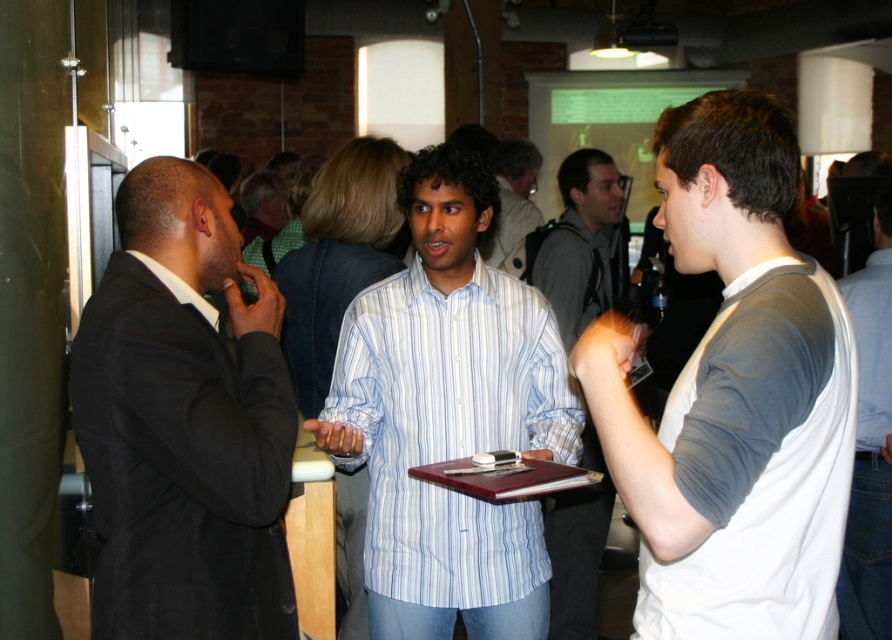
You are a photographer at the event and want to capture a photo of the black matte suit at left and the white fabric shirt at center. To ensure both are in focus, which one should you focus on first according to their positions?

The black matte suit at left is in front of the white fabric shirt at center, so you should focus on the black matte suit at left first to ensure both are in focus.